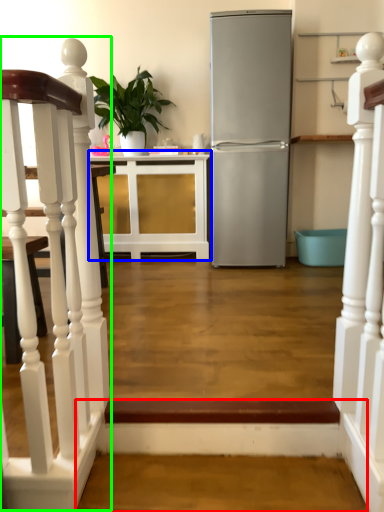
Question: Estimate the real-world distances between objects in this image. Which object is farther from stairwell (highlighted by a red box), cabinetry (highlighted by a blue box) or stairwell (highlighted by a green box)?

Choices:
 (A) cabinetry
 (B) stairwell

Answer: (A)